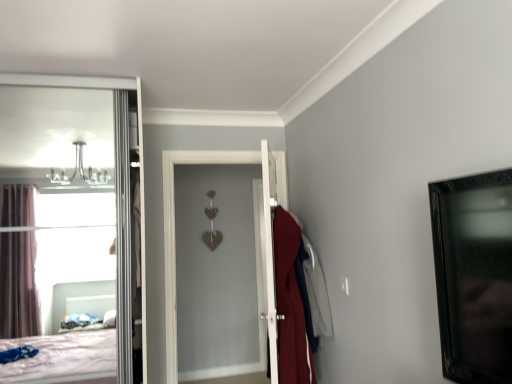
Question: From their relative heights in the image, would you say velvet red robe at center is taller or shorter than black glossy picture frame at right?

Choices:
 (A) tall
 (B) short

Answer: (A)

Question: Do you think velvet red robe at center is within black glossy picture frame at right, or outside of it?

Choices:
 (A) inside
 (B) outside

Answer: (B)

Question: In the image, is velvet red robe at center on the left side or the right side of black glossy picture frame at right?

Choices:
 (A) right
 (B) left

Answer: (B)

Question: Would you say black glossy picture frame at right is inside or outside velvet red robe at center?

Choices:
 (A) inside
 (B) outside

Answer: (B)

Question: Does point (455, 188) appear closer or farther from the camera than point (313, 317)?

Choices:
 (A) farther
 (B) closer

Answer: (B)

Question: Based on their positions, is black glossy picture frame at right located to the left or right of velvet red robe at center?

Choices:
 (A) right
 (B) left

Answer: (A)

Question: Based on their sizes in the image, would you say black glossy picture frame at right is bigger or smaller than velvet red robe at center?

Choices:
 (A) small
 (B) big

Answer: (A)